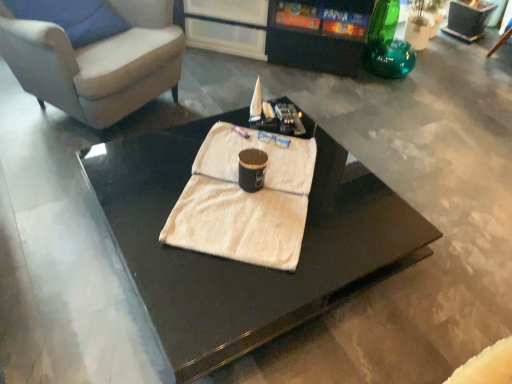
Where is `free space below white textured towel at center (from a real-world perspective)`? The height and width of the screenshot is (384, 512). free space below white textured towel at center (from a real-world perspective) is located at coordinates (236, 221).